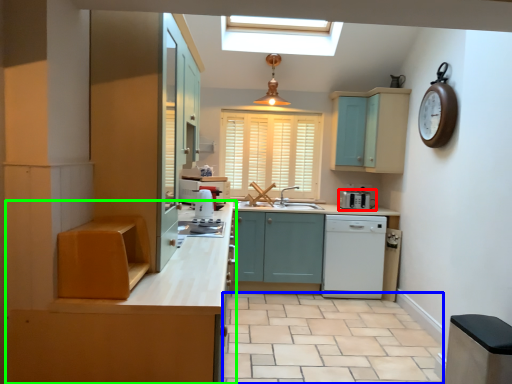
Question: Considering the real-world distances, which object is closest to kitchen appliance (highlighted by a red box)? tile (highlighted by a blue box) or cabinetry (highlighted by a green box).

Choices:
 (A) tile
 (B) cabinetry

Answer: (A)